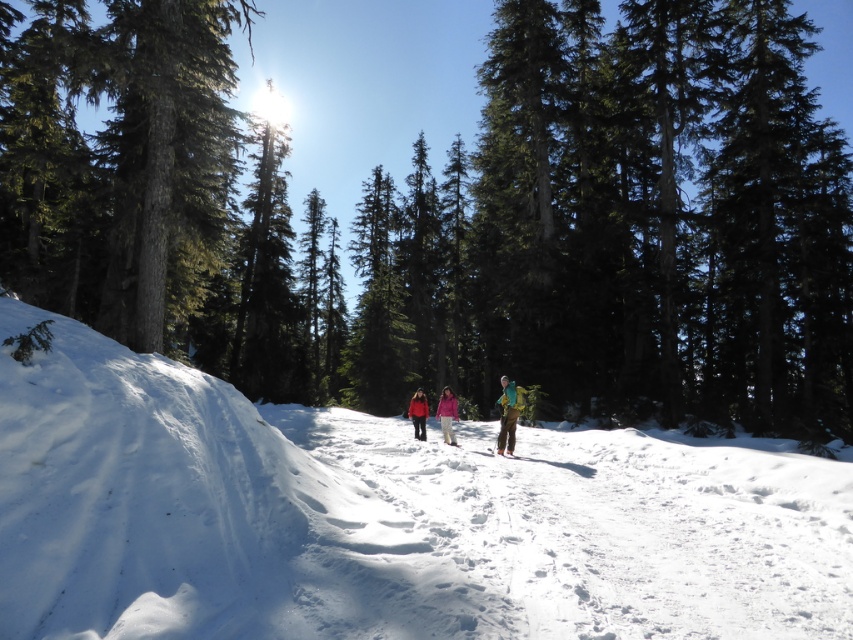
Question: Which of the following is the closest to the observer?

Choices:
 (A) (422, 404)
 (B) (381, 440)
 (C) (439, 401)

Answer: (B)

Question: Which of the following is the farthest from the observer?

Choices:
 (A) green fabric backpack at center
 (B) matte yellow ski at center
 (C) white snow at center

Answer: (A)

Question: Is white snow at center above pink fabric jacket at center?

Choices:
 (A) no
 (B) yes

Answer: (B)

Question: Where is white powdery snow at center located in relation to matte red jacket at center in the image?

Choices:
 (A) below
 (B) above

Answer: (B)

Question: Considering the real-world distances, which object is closest to the white snow at center?

Choices:
 (A) green textured tree at center
 (B) matte yellow ski at center
 (C) green fabric backpack at center

Answer: (C)

Question: Is pink fabric jacket at center bigger than matte red jacket at center?

Choices:
 (A) no
 (B) yes

Answer: (B)